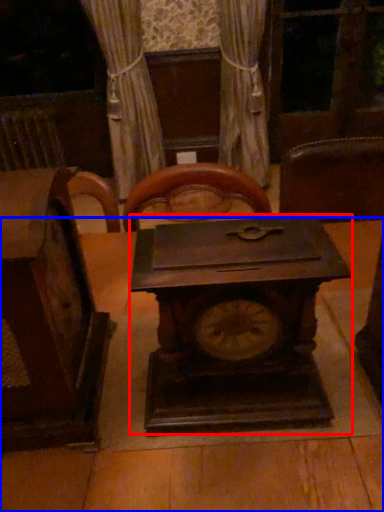
Question: Among these objects, which one is farthest to the camera, clock (highlighted by a red box) or table (highlighted by a blue box)?

Choices:
 (A) clock
 (B) table

Answer: (B)